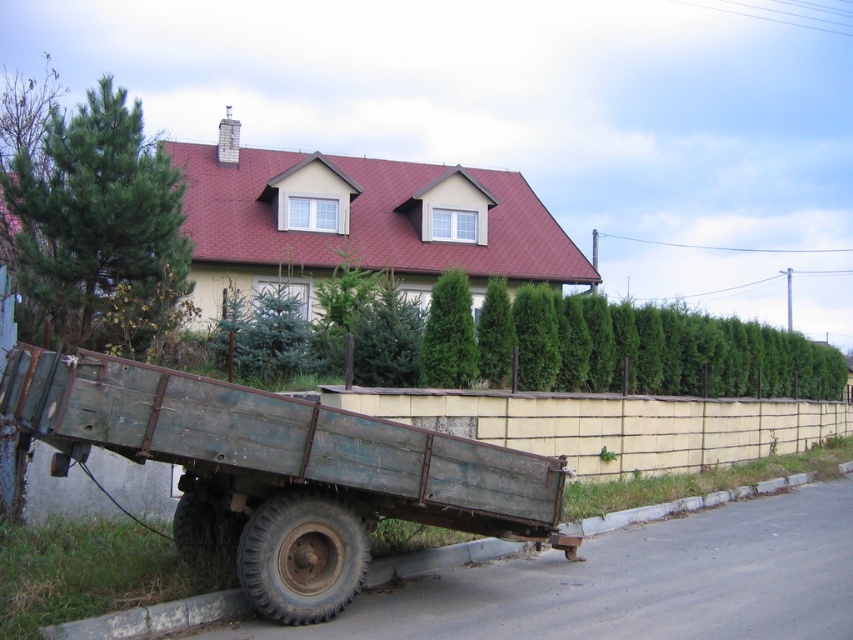
You are standing at the entrance of the property and want to move the rusty metal wagon at lower left to the back of the green leafy hedge at center. Is the wagon currently positioned in a way that allows you to move it behind the hedge without moving the hedge first?

The rusty metal wagon at lower left is located below the green leafy hedge at center, so it is already positioned behind the hedge. Therefore, there is no need to move the hedge first to relocate the wagon behind it.

You are standing at the entrance of the property and want to reach the green leafy hedge at center. Based on the scene description, in which direction should you walk from your current position?

The green leafy hedge at center is located at point (553, 342), so you should walk towards the center of the property to reach it.

From the picture: You are a gardener who needs to move a bag of soil from the house to the trailer. You see the rusty metal wagon at lower left and the gray concrete curb at lower left. Which object should you use to carry the soil, and why?

You should use the rusty metal wagon at lower left to carry the soil because it is designed for transporting items, whereas the gray concrete curb at lower left is a stationary structure along the pavement and cannot be moved.